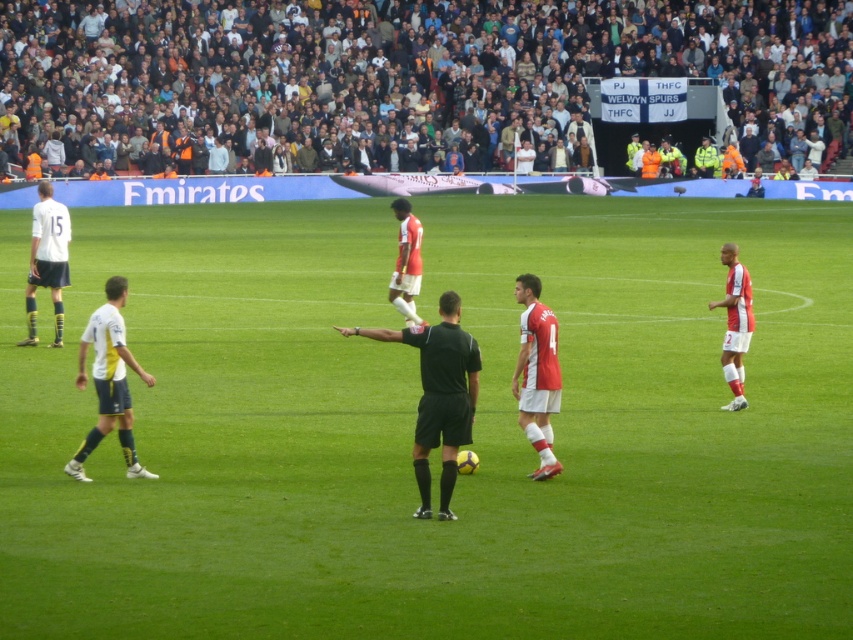
Question: Does white jersey at left have a larger size compared to white matte jersey at center?

Choices:
 (A) yes
 (B) no

Answer: (A)

Question: From the image, what is the correct spatial relationship of white jersey at left in relation to white jersey at right?

Choices:
 (A) below
 (B) above

Answer: (A)

Question: Is white jersey at right positioned at the back of white jersey at center?

Choices:
 (A) yes
 (B) no

Answer: (B)

Question: Which of these objects is positioned closest to the black shorts at center?

Choices:
 (A) black fabric referee at center
 (B) green grass football field at center
 (C) white matte shorts at left
 (D) white matte jersey at center

Answer: (C)

Question: Among these objects, which one is nearest to the camera?

Choices:
 (A) white jersey at left
 (B) white jersey at right
 (C) green grass football field at center

Answer: (C)

Question: Which of the following is the closest to the observer?

Choices:
 (A) (425, 1)
 (B) (398, 209)
 (C) (555, 332)
 (D) (733, 321)

Answer: (C)